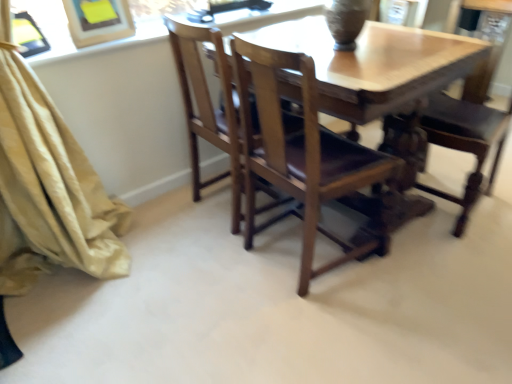
Measure the distance between wooden chair at center, acting as the 2th chair starting from the right, and camera.

A distance of 4.31 feet exists between wooden chair at center, acting as the 2th chair starting from the right, and camera.

I want to click on wooden chair at center, the 1th chair from the left, so click(346, 67).

Can you confirm if wooden chair at center, the 1th chair from the left, is bigger than matte brown vase at upper center?

Yes.

Can you tell me how much wooden chair at center, acting as the 2th chair starting from the right, and matte brown vase at upper center differ in facing direction?

The facing directions of wooden chair at center, acting as the 2th chair starting from the right, and matte brown vase at upper center are 87.6 degrees apart.

Does wooden chair at center, acting as the 2th chair starting from the right, appear on the left side of matte brown vase at upper center?

Yes, wooden chair at center, acting as the 2th chair starting from the right, is to the left of matte brown vase at upper center.

Between wooden chair at center, the 1th chair from the left, and matte brown vase at upper center, which one is positioned in front?

wooden chair at center, the 1th chair from the left, is closer to the camera.

Does wooden chair at center, acting as the 2th chair starting from the right, have a larger size compared to beige fabric curtain at left?

Actually, wooden chair at center, acting as the 2th chair starting from the right, might be smaller than beige fabric curtain at left.

In the image, is wooden chair at center, acting as the 2th chair starting from the right, on the left side or the right side of beige fabric curtain at left?

From the image, it's evident that wooden chair at center, acting as the 2th chair starting from the right, is to the right of beige fabric curtain at left.

Looking at this image, is wooden chair at center, acting as the 2th chair starting from the right, positioned beyond the bounds of beige fabric curtain at left?

Yes.

From a real-world perspective, who is located lower, wooden chair at center, acting as the 2th chair starting from the right, or beige fabric curtain at left?

wooden chair at center, acting as the 2th chair starting from the right.

Is beige fabric curtain at left thinner than wooden chair at center, which is the second chair in left-to-right order?

Indeed, beige fabric curtain at left has a lesser width compared to wooden chair at center, which is the second chair in left-to-right order.

Is beige fabric curtain at left surrounding wooden chair at center, the 1th chair from the right?

Actually, wooden chair at center, the 1th chair from the right, is outside beige fabric curtain at left.

Is beige fabric curtain at left beside wooden chair at center, which is the second chair in left-to-right order?

No, beige fabric curtain at left is not next to wooden chair at center, which is the second chair in left-to-right order.

Which object is further away from the camera taking this photo, beige fabric curtain at left or wooden chair at center, the 1th chair from the right?

wooden chair at center, the 1th chair from the right, is further from the camera.

Which of these two, wooden chair at center, which is the second chair in left-to-right order, or matte brown vase at upper center, is thinner?

With smaller width is matte brown vase at upper center.

Identify the location of chair that is the 1st object located below the matte brown vase at upper center (from the image's perspective). The height and width of the screenshot is (384, 512). click(472, 110).

Who is shorter, wooden chair at center, the 1th chair from the right, or matte brown vase at upper center?

With less height is matte brown vase at upper center.

Does wooden chair at center, the 1th chair from the right, touch wooden chair at center, acting as the 2th chair starting from the right?

No, wooden chair at center, the 1th chair from the right, is not making contact with wooden chair at center, acting as the 2th chair starting from the right.

Is wooden chair at center, the 1th chair from the right, facing towards wooden chair at center, acting as the 2th chair starting from the right?

Yes, wooden chair at center, the 1th chair from the right, is facing wooden chair at center, acting as the 2th chair starting from the right.

From the image's perspective, is wooden chair at center, which is the second chair in left-to-right order, under wooden chair at center, acting as the 2th chair starting from the right?

No, from the image's perspective, wooden chair at center, which is the second chair in left-to-right order, is not below wooden chair at center, acting as the 2th chair starting from the right.

From the image's perspective, would you say matte brown vase at upper center is shown under wooden chair at center, which is the second chair in left-to-right order?

No.

Which is more to the left, matte brown vase at upper center or wooden chair at center, the 1th chair from the right?

From the viewer's perspective, matte brown vase at upper center appears more on the left side.

Which is nearer, (340, 50) or (470, 125)?

Point (340, 50) appears to be closer to the viewer than point (470, 125).

Can wooden chair at center, which is the second chair in left-to-right order, be found inside matte brown vase at upper center?

Definitely not — wooden chair at center, which is the second chair in left-to-right order, is not inside matte brown vase at upper center.

Could you tell me if wooden chair at center, which is the second chair in left-to-right order, is turned towards beige fabric curtain at left?

No, wooden chair at center, which is the second chair in left-to-right order, is not oriented towards beige fabric curtain at left.

Based on the photo, measure the distance between wooden chair at center, which is the second chair in left-to-right order, and beige fabric curtain at left.

They are 1.51 meters apart.

Does wooden chair at center, the 1th chair from the right, have a greater height compared to beige fabric curtain at left?

Incorrect, the height of wooden chair at center, the 1th chair from the right, is not larger of that of beige fabric curtain at left.

Does wooden chair at center, which is the second chair in left-to-right order, touch beige fabric curtain at left?

wooden chair at center, which is the second chair in left-to-right order, and beige fabric curtain at left are not in contact.

Image resolution: width=512 pixels, height=384 pixels. In order to click on glass vase located above the wooden chair at center, acting as the 2th chair starting from the right (from the image's perspective) in this screenshot , I will do `click(346, 21)`.

In the image, there is a beige fabric curtain at left. Where is `chair below it (from the image's perspective)`? The image size is (512, 384). chair below it (from the image's perspective) is located at coordinates (346, 67).

Estimate the real-world distances between objects in this image. Which object is closer to beige fabric curtain at left, wooden chair at center, acting as the 2th chair starting from the right, or matte brown vase at upper center?

Among the two, wooden chair at center, acting as the 2th chair starting from the right, is located nearer to beige fabric curtain at left.

Estimate the real-world distances between objects in this image. Which object is further from beige fabric curtain at left, wooden chair at center, the 1th chair from the right, or matte brown vase at upper center?

wooden chair at center, the 1th chair from the right, is positioned further to the anchor beige fabric curtain at left.

Estimate the real-world distances between objects in this image. Which object is closer to wooden chair at center, the 1th chair from the right, beige fabric curtain at left or matte brown vase at upper center?

Among the two, matte brown vase at upper center is located nearer to wooden chair at center, the 1th chair from the right.

From the image, which object appears to be farther from wooden chair at center, acting as the 2th chair starting from the right, wooden chair at center, which is the second chair in left-to-right order, or beige fabric curtain at left?

The object further to wooden chair at center, acting as the 2th chair starting from the right, is beige fabric curtain at left.

In the scene shown: Considering their positions, is matte brown vase at upper center positioned closer to beige fabric curtain at left than wooden chair at center, acting as the 2th chair starting from the right?

wooden chair at center, acting as the 2th chair starting from the right, is closer to beige fabric curtain at left.

Consider the image. Estimate the real-world distances between objects in this image. Which object is closer to wooden chair at center, acting as the 2th chair starting from the right, matte brown vase at upper center or beige fabric curtain at left?

The object closer to wooden chair at center, acting as the 2th chair starting from the right, is matte brown vase at upper center.

Estimate the real-world distances between objects in this image. Which object is further from wooden chair at center, the 1th chair from the left, matte brown vase at upper center or wooden chair at center, the 1th chair from the right?

The object further to wooden chair at center, the 1th chair from the left, is wooden chair at center, the 1th chair from the right.

Looking at the image, which one is located further to matte brown vase at upper center, beige fabric curtain at left or wooden chair at center, the 1th chair from the left?

The object further to matte brown vase at upper center is beige fabric curtain at left.

Locate an element on the screen. glass vase located between beige fabric curtain at left and wooden chair at center, which is the second chair in left-to-right order, in the left-right direction is located at coordinates (346, 21).

The height and width of the screenshot is (384, 512). Identify the location of glass vase between wooden chair at center, acting as the 2th chair starting from the right, and wooden chair at center, the 1th chair from the right. 346,21.

You are a GUI agent. You are given a task and a screenshot of the screen. Output one action in this format:
    pyautogui.click(x=<x>, y=<y>)
    Task: Click on the chair between beige fabric curtain at left and wooden chair at center, the 1th chair from the right, from left to right
    
    Given the screenshot: What is the action you would take?
    pyautogui.click(x=346, y=67)

Locate an element on the screen. chair situated between beige fabric curtain at left and matte brown vase at upper center from left to right is located at coordinates (346, 67).